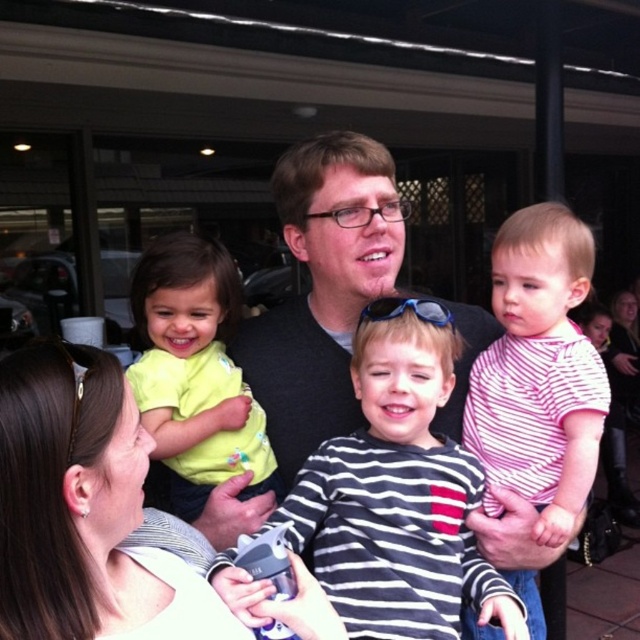
Question: Which point appears farthest from the camera in this image?

Choices:
 (A) (566, 372)
 (B) (81, 371)

Answer: (A)

Question: Which of the following is the closest to the observer?

Choices:
 (A) (257, 467)
 (B) (124, 481)
 (C) (548, 224)

Answer: (B)

Question: Does striped cotton shirt at center appear on the right side of black matte shirt at center?

Choices:
 (A) no
 (B) yes

Answer: (B)

Question: Can you confirm if striped cotton shirt at center is positioned to the left of black matte shirt at center?

Choices:
 (A) no
 (B) yes

Answer: (A)

Question: Which object is the farthest from the pink striped shirt at center?

Choices:
 (A) white matte shirt at center
 (B) light green fabric shirt at left
 (C) black matte shirt at center
 (D) striped cotton shirt at center

Answer: (A)

Question: Does white matte shirt at center have a larger size compared to black matte shirt at center?

Choices:
 (A) yes
 (B) no

Answer: (B)